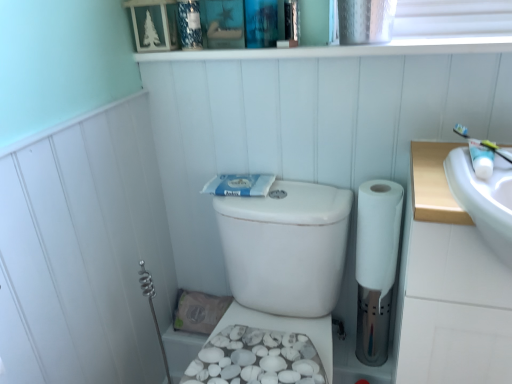
This screenshot has height=384, width=512. In order to click on white matte toilet paper at right in this screenshot , I will do coord(376,265).

What is the approximate height of white matte toilet paper at right?

11.45 inches.

Locate an element on the screen. The height and width of the screenshot is (384, 512). white plastic toothbrush at upper right is located at coordinates (483, 143).

What is the approximate height of white glossy ledge at upper center?

The height of white glossy ledge at upper center is 1.03 inches.

The height and width of the screenshot is (384, 512). Describe the element at coordinates (239, 185) in the screenshot. I see `blue matte toothpaste at center` at that location.

Find the location of a particular element. This screenshot has width=512, height=384. blue textured candle at upper center, marked as the 1th toiletry in a back-to-front arrangement is located at coordinates (189, 24).

Is blue matte toothpaste at center positioned with its back to white matte toilet paper at right?

blue matte toothpaste at center is not turned away from white matte toilet paper at right.

In the image, is blue matte toothpaste at center positioned in front of or behind white matte toilet paper at right?

blue matte toothpaste at center is positioned farther from the viewer than white matte toilet paper at right.

Which object is positioned more to the left, blue matte toothpaste at center or white matte toilet paper at right?

blue matte toothpaste at center.

From a real-world perspective, is blue matte toothpaste at center physically located above or below white matte toilet paper at right?

blue matte toothpaste at center is situated higher than white matte toilet paper at right in the real world.

Based on the photo, is white glossy ledge at upper center wider than white matte toilet paper at right?

Correct, the width of white glossy ledge at upper center exceeds that of white matte toilet paper at right.

Can you confirm if white glossy ledge at upper center is smaller than white matte toilet paper at right?

No, white glossy ledge at upper center is not smaller than white matte toilet paper at right.

From a real-world perspective, is white glossy ledge at upper center below white matte toilet paper at right?

No, from a real-world perspective, white glossy ledge at upper center is not beneath white matte toilet paper at right.

From the image's perspective, which is above, white glossy ledge at upper center or white matte toilet paper at right?

white glossy ledge at upper center, from the image's perspective.

From the image's perspective, which is above, white glossy toothpaste tube at upper right, the 1th toiletry in the right-to-left sequence, or blue textured candle at upper center, the 2th toiletry viewed from the right?

blue textured candle at upper center, the 2th toiletry viewed from the right.

From a real-world perspective, who is located higher, white glossy toothpaste tube at upper right, placed as the second toiletry when sorted from left to right, or blue textured candle at upper center, the 2th toiletry viewed from the right?

In real-world perspective, blue textured candle at upper center, the 2th toiletry viewed from the right, is above.

How different are the orientations of white glossy toothpaste tube at upper right, placed as the second toiletry when sorted from left to right, and blue textured candle at upper center, marked as the 2th toiletry in a bottom-to-top arrangement, in degrees?

The facing directions of white glossy toothpaste tube at upper right, placed as the second toiletry when sorted from left to right, and blue textured candle at upper center, marked as the 2th toiletry in a bottom-to-top arrangement, are 6.58 degrees apart.

Considering the relative positions of white glossy toothpaste tube at upper right, which ranks as the first toiletry in bottom-to-top order, and blue textured candle at upper center, the 2th toiletry positioned from the front, in the image provided, is white glossy toothpaste tube at upper right, which ranks as the first toiletry in bottom-to-top order, to the left of blue textured candle at upper center, the 2th toiletry positioned from the front, from the viewer's perspective?

Incorrect, white glossy toothpaste tube at upper right, which ranks as the first toiletry in bottom-to-top order, is not on the left side of blue textured candle at upper center, the 2th toiletry positioned from the front.

Is white glossy toothpaste tube at upper right, positioned as the first toiletry in front-to-back order, located outside blue matte toothpaste at center?

white glossy toothpaste tube at upper right, positioned as the first toiletry in front-to-back order, is positioned outside blue matte toothpaste at center.

Between white glossy toothpaste tube at upper right, positioned as the first toiletry in front-to-back order, and blue matte toothpaste at center, which one appears on the right side from the viewer's perspective?

From the viewer's perspective, white glossy toothpaste tube at upper right, positioned as the first toiletry in front-to-back order, appears more on the right side.

Which object is further away from the camera, white glossy toothpaste tube at upper right, the 2th toiletry viewed from the top, or blue matte toothpaste at center?

blue matte toothpaste at center is further away from the camera.

Is point (478, 157) closer to camera compared to point (254, 194)?

Yes.

Between point (180, 25) and point (370, 216), which one is positioned behind?

The point (180, 25) is farther.

Does blue textured candle at upper center, the 2th toiletry positioned from the front, have a larger size compared to white matte toilet paper at right?

Actually, blue textured candle at upper center, the 2th toiletry positioned from the front, might be smaller than white matte toilet paper at right.

Considering their positions, is blue textured candle at upper center, marked as the 1th toiletry in a back-to-front arrangement, located in front of or behind white matte toilet paper at right?

blue textured candle at upper center, marked as the 1th toiletry in a back-to-front arrangement, is positioned farther from the viewer than white matte toilet paper at right.

From a real-world perspective, is blue textured candle at upper center, marked as the 1th toiletry in a back-to-front arrangement, physically above white matte toilet paper at right?

Yes, from a real-world perspective, blue textured candle at upper center, marked as the 1th toiletry in a back-to-front arrangement, is above white matte toilet paper at right.

How many degrees apart are the facing directions of white plastic toothbrush at upper right and white matte toilet paper at right?

43 degrees.

Is white plastic toothbrush at upper right to the right of white matte toilet paper at right from the viewer's perspective?

Correct, you'll find white plastic toothbrush at upper right to the right of white matte toilet paper at right.

Would you say white plastic toothbrush at upper right is outside white matte toilet paper at right?

Yes.

Would you say white plastic toothbrush at upper right is a long distance from white matte toilet paper at right?

white plastic toothbrush at upper right is actually quite close to white matte toilet paper at right.

In the scene shown: From the image's perspective, which is above, white glossy toothpaste tube at upper right, the 1th toiletry in the right-to-left sequence, or white glossy ledge at upper center?

white glossy ledge at upper center.

Which is nearer, (490, 165) or (147, 54)?

Point (490, 165) appears to be closer to the viewer than point (147, 54).

From a real-world perspective, between white glossy toothpaste tube at upper right, positioned as the first toiletry in front-to-back order, and white glossy ledge at upper center, who is vertically higher?

white glossy ledge at upper center.

Is white glossy toothpaste tube at upper right, the 2th toiletry viewed from the top, not inside white glossy ledge at upper center?

Absolutely, white glossy toothpaste tube at upper right, the 2th toiletry viewed from the top, is external to white glossy ledge at upper center.

Locate an element on the screen. toothpaste on the left of white matte toilet paper at right is located at coordinates (239, 185).

Image resolution: width=512 pixels, height=384 pixels. Find the location of `toilet paper located below the white glossy ledge at upper center (from the image's perspective)`. toilet paper located below the white glossy ledge at upper center (from the image's perspective) is located at coordinates (376, 265).

When comparing their distances from blue matte toothpaste at center, does white plastic toothbrush at upper right or white matte toilet paper at right seem further?

The object further to blue matte toothpaste at center is white plastic toothbrush at upper right.

Estimate the real-world distances between objects in this image. Which object is further from blue textured candle at upper center, the first toiletry viewed from the top, white glossy ledge at upper center or white textured bidet at lower center?

Among the two, white textured bidet at lower center is located further to blue textured candle at upper center, the first toiletry viewed from the top.

Looking at the image, which one is located further to white glossy toothpaste tube at upper right, which ranks as the first toiletry in bottom-to-top order, blue matte toothpaste at center or white textured bidet at lower center?

white textured bidet at lower center.

Considering their positions, is blue textured candle at upper center, which is counted as the first toiletry, starting from the left, positioned closer to white glossy toothpaste tube at upper right, which ranks as the first toiletry in bottom-to-top order, than blue matte toothpaste at center?

blue matte toothpaste at center is positioned closer to the anchor white glossy toothpaste tube at upper right, which ranks as the first toiletry in bottom-to-top order.

From the image, which object appears to be farther from white glossy ledge at upper center, white plastic toothbrush at upper right or white matte toilet paper at right?

Based on the image, white matte toilet paper at right appears to be further to white glossy ledge at upper center.

Consider the image. Which object lies nearer to the anchor point white glossy ledge at upper center, white glossy toothpaste tube at upper right, the 2th toiletry viewed from the top, or blue matte toothpaste at center?

The object closer to white glossy ledge at upper center is white glossy toothpaste tube at upper right, the 2th toiletry viewed from the top.

When comparing their distances from white glossy ledge at upper center, does white textured bidet at lower center or blue textured candle at upper center, the first toiletry viewed from the top, seem closer?

blue textured candle at upper center, the first toiletry viewed from the top, lies closer to white glossy ledge at upper center than the other object.

Based on their spatial positions, is blue textured candle at upper center, the 2th toiletry positioned from the front, or white glossy ledge at upper center closer to white textured bidet at lower center?

Among the two, white glossy ledge at upper center is located nearer to white textured bidet at lower center.

Identify the location of toiletry that lies between white plastic toothbrush at upper right and white textured bidet at lower center from top to bottom. (481, 159).

I want to click on toiletry between blue textured candle at upper center, the 2th toiletry positioned from the front, and white textured bidet at lower center, in the vertical direction, so click(481, 159).

In order to click on ledge that lies between blue textured candle at upper center, the 2th toiletry viewed from the right, and white textured bidet at lower center from top to bottom in this screenshot , I will do `click(346, 49)`.

Locate an element on the screen. toothpaste between white plastic toothbrush at upper right and white textured bidet at lower center from top to bottom is located at coordinates (239, 185).